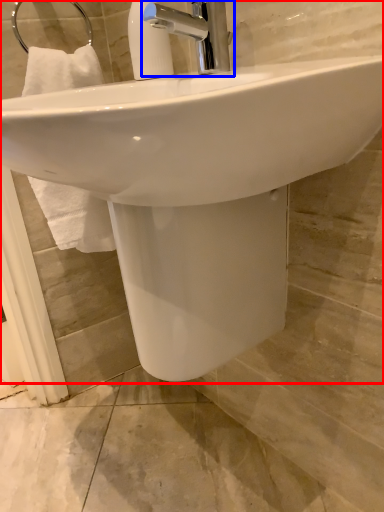
Question: Which of the following is the farthest to the observer, sink (highlighted by a red box) or tap (highlighted by a blue box)?

Choices:
 (A) sink
 (B) tap

Answer: (B)